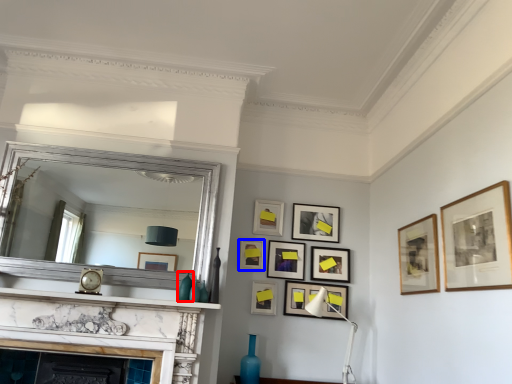
Question: Which of the following is the closest to the observer, vase (highlighted by a red box) or picture frame (highlighted by a blue box)?

Choices:
 (A) vase
 (B) picture frame

Answer: (A)